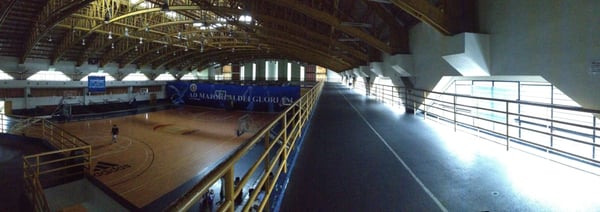
The width and height of the screenshot is (600, 212). Find the location of `windows on roof`. windows on roof is located at coordinates (199, 24), (143, 4), (246, 17).